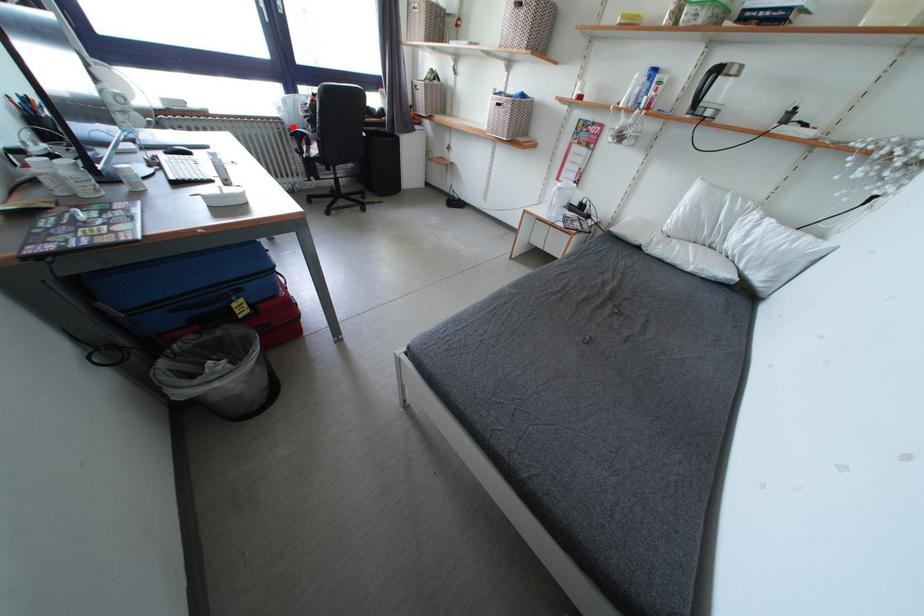
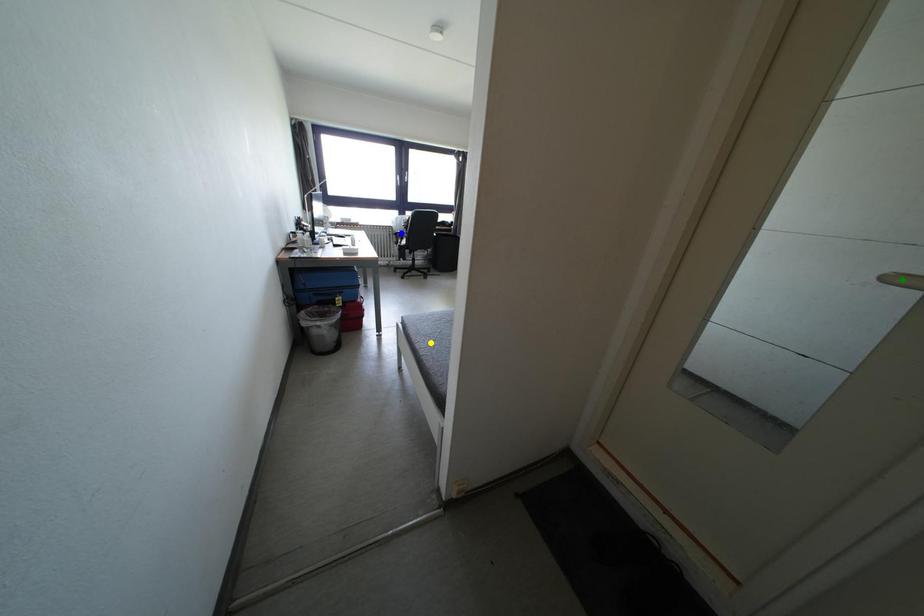
Question: I am providing you with two images of the same scene from different viewpoints. A red point is marked on the first image. You are given multiple points on the second image. Can you choose the point in image 2 that corresponds to the point in image 1?

Choices:
 (A) blue point
 (B) yellow point
 (C) green point

Answer: (A)